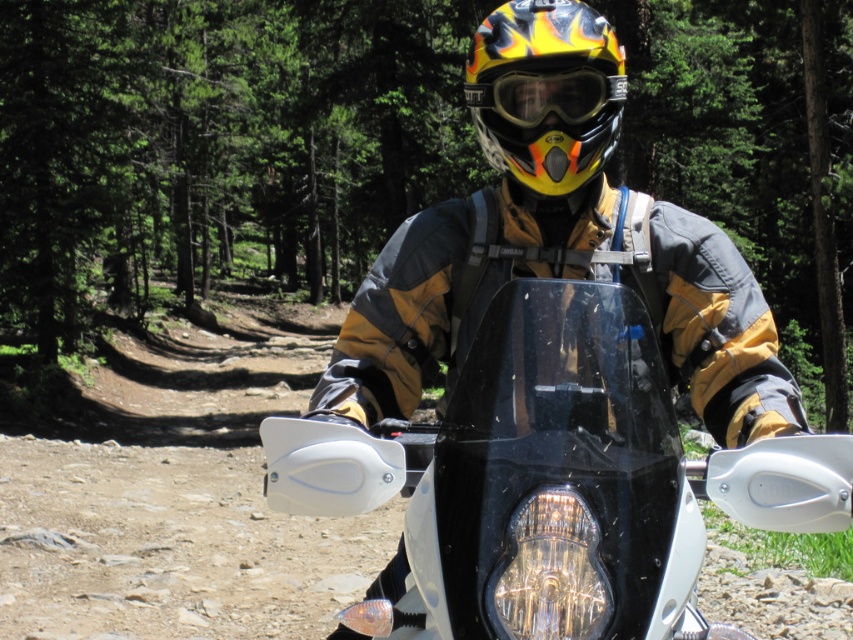
Question: Can you confirm if green leafy pine forest at upper center is positioned to the right of flame-patterned plastic helmet at center?

Choices:
 (A) yes
 (B) no

Answer: (B)

Question: Which point is farther to the camera?

Choices:
 (A) (651, 460)
 (B) (685, 189)
 (C) (544, 44)

Answer: (B)

Question: Which of the following is the closest to the observer?

Choices:
 (A) (494, 76)
 (B) (845, 451)
 (C) (750, 24)

Answer: (B)

Question: Does green leafy pine forest at upper center appear under flame-patterned plastic helmet at center?

Choices:
 (A) yes
 (B) no

Answer: (B)

Question: Where is flame-patterned plastic helmet at center located in relation to yellow matte/glossy goggles at center in the image?

Choices:
 (A) above
 (B) below

Answer: (A)

Question: Which point is closer to the camera?

Choices:
 (A) (583, 141)
 (B) (409, 625)

Answer: (B)